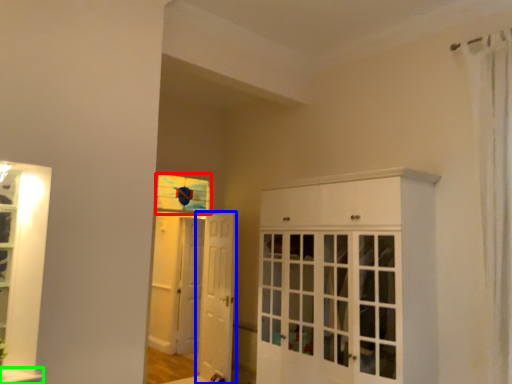
Question: Which object is positioned closest to window (highlighted by a red box)? Select from door (highlighted by a blue box) and window sill (highlighted by a green box).

Choices:
 (A) door
 (B) window sill

Answer: (A)